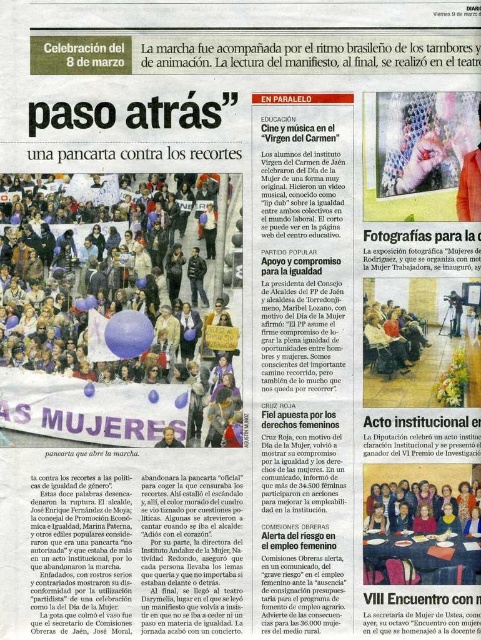
You are a photographer reviewing the layout of a newspaper page. You notice the textured fabric scarf at upper center and the matte black camera at center. Which object is located to the right of the other?

The textured fabric scarf at upper center is positioned on the right side of the matte black camera at center.